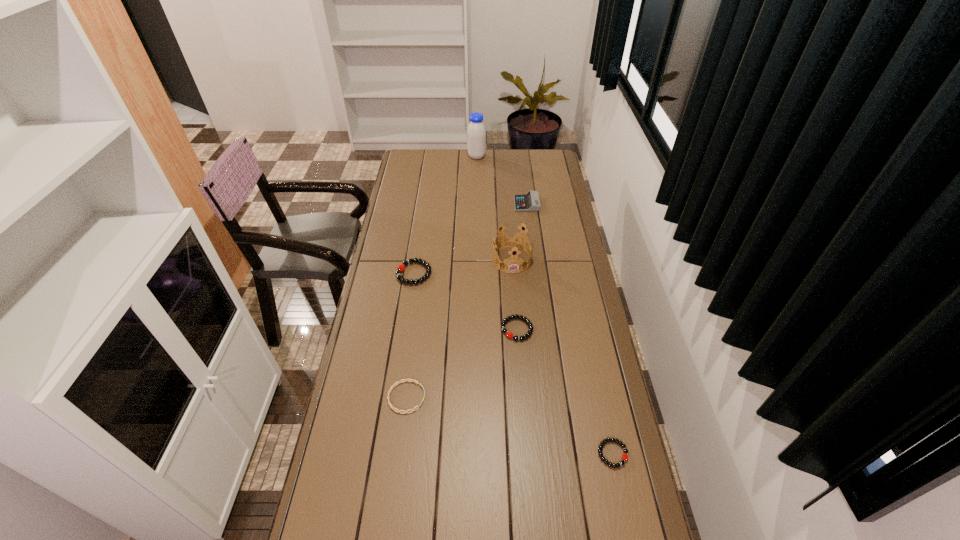
Where is `free area in between the soya milk and the rightmost bracelet`? This screenshot has width=960, height=540. free area in between the soya milk and the rightmost bracelet is located at coordinates (544, 305).

Where is `empty space that is in between the third nearest bracelet and the second nearest object`? The image size is (960, 540). empty space that is in between the third nearest bracelet and the second nearest object is located at coordinates (462, 363).

This screenshot has width=960, height=540. What are the coordinates of `vacant area that lies between the calculator and the soya milk` in the screenshot? It's located at pyautogui.click(x=502, y=180).

You are a GUI agent. You are given a task and a screenshot of the screen. Output one action in this format:
    pyautogui.click(x=<x>, y=<y>)
    Task: Click on the object that ranks as the third closest to the second biggest black bracelet
    The height and width of the screenshot is (540, 960).
    Given the screenshot: What is the action you would take?
    pyautogui.click(x=401, y=267)

In order to click on object that is the closest one to the second black bracelet from right to left in this screenshot , I will do `click(512, 241)`.

Where is `bracelet that is the closest one to the smallest black bracelet`? Image resolution: width=960 pixels, height=540 pixels. bracelet that is the closest one to the smallest black bracelet is located at coordinates (530, 330).

Point out which bracelet is positioned as the second nearest to the rightmost object. Please provide its 2D coordinates. Your answer should be formatted as a tuple, i.e. [(x, y)], where the tuple contains the x and y coordinates of a point satisfying the conditions above.

[(398, 382)]

Locate an element on the screen. Image resolution: width=960 pixels, height=540 pixels. black bracelet that stands as the closest to the rightmost black bracelet is located at coordinates (530, 330).

The image size is (960, 540). What are the coordinates of `black bracelet object that ranks as the closest to the soya milk` in the screenshot? It's located at (401, 267).

Locate an element on the screen. Image resolution: width=960 pixels, height=540 pixels. free region that satisfies the following two spatial constraints: 1. on the surface of the rightmost black bracelet showing star-shaped elements; 2. on the right side of the blue bracelet is located at coordinates (399, 454).